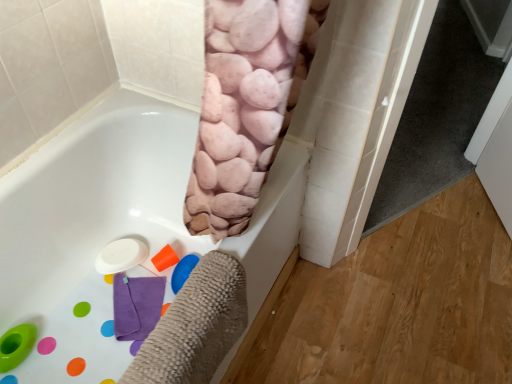
You are a GUI agent. You are given a task and a screenshot of the screen. Output one action in this format:
    pyautogui.click(x=<x>, y=<y>)
    Task: Click on the white matte bathtub at center
    The image size is (512, 384).
    Given the screenshot: What is the action you would take?
    pyautogui.click(x=118, y=226)

Describe the element at coordinates (118, 226) in the screenshot. I see `white matte bathtub at center` at that location.

Where is `white glossy screen door at right`? The height and width of the screenshot is (384, 512). white glossy screen door at right is located at coordinates 436,117.

What do you see at coordinates (436, 117) in the screenshot?
I see `white glossy screen door at right` at bounding box center [436, 117].

Locate an element on the screen. The height and width of the screenshot is (384, 512). white matte bathtub at center is located at coordinates (118, 226).

Is white matte bathtub at center to the right of white glossy screen door at right from the viewer's perspective?

In fact, white matte bathtub at center is to the left of white glossy screen door at right.

In the image, is white matte bathtub at center positioned in front of or behind white glossy screen door at right?

Clearly, white matte bathtub at center is in front of white glossy screen door at right.

Does point (124, 361) lie behind point (466, 164)?

No, (124, 361) is closer to viewer.

From the image's perspective, would you say white matte bathtub at center is shown under white glossy screen door at right?

Indeed, from the image's perspective, white matte bathtub at center is shown beneath white glossy screen door at right.

From a real-world perspective, is white matte bathtub at center under white glossy screen door at right?

Yes, from a real-world perspective, white matte bathtub at center is under white glossy screen door at right.

Which object is thinner, white matte bathtub at center or white glossy screen door at right?

Thinner between the two is white glossy screen door at right.

Considering the sizes of objects white matte bathtub at center and white glossy screen door at right in the image provided, who is taller, white matte bathtub at center or white glossy screen door at right?

Standing taller between the two is white glossy screen door at right.

Considering the relative sizes of white matte bathtub at center and white glossy screen door at right in the image provided, is white matte bathtub at center smaller than white glossy screen door at right?

No, white matte bathtub at center is not smaller than white glossy screen door at right.

Is white matte bathtub at center inside or outside of white glossy screen door at right?

white matte bathtub at center exists outside the volume of white glossy screen door at right.

Is white matte bathtub at center touching white glossy screen door at right?

They are not placed beside each other.

Is white matte bathtub at center oriented towards white glossy screen door at right?

No, white matte bathtub at center is not aimed at white glossy screen door at right.

How much distance is there between white matte bathtub at center and white glossy screen door at right?

white matte bathtub at center is 1.24 meters from white glossy screen door at right.

In order to click on screen door that is above the white matte bathtub at center (from the image's perspective) in this screenshot , I will do `click(436, 117)`.

Considering the positions of objects white glossy screen door at right and white matte bathtub at center in the image provided, who is more to the right, white glossy screen door at right or white matte bathtub at center?

From the viewer's perspective, white glossy screen door at right appears more on the right side.

Does white glossy screen door at right lie behind white matte bathtub at center?

Yes, white glossy screen door at right is behind white matte bathtub at center.

Is point (468, 106) less distant than point (275, 227)?

No, it is not.

From the image's perspective, which one is positioned higher, white glossy screen door at right or white matte bathtub at center?

From the image's view, white glossy screen door at right is above.

Consider the image. From a real-world perspective, is white glossy screen door at right located higher than white matte bathtub at center?

Indeed, from a real-world perspective, white glossy screen door at right stands above white matte bathtub at center.

Does white glossy screen door at right have a lesser width compared to white matte bathtub at center?

Yes, white glossy screen door at right is thinner than white matte bathtub at center.

In the scene shown: Considering the sizes of objects white glossy screen door at right and white matte bathtub at center in the image provided, who is taller, white glossy screen door at right or white matte bathtub at center?

With more height is white glossy screen door at right.

Between white glossy screen door at right and white matte bathtub at center, which one has larger size?

white matte bathtub at center is bigger.

Can white matte bathtub at center be found inside white glossy screen door at right?

Actually, white matte bathtub at center is outside white glossy screen door at right.

Are white glossy screen door at right and white matte bathtub at center making contact?

No, white glossy screen door at right is not with white matte bathtub at center.

Is white glossy screen door at right aimed at white matte bathtub at center?

No, white glossy screen door at right is not turned towards white matte bathtub at center.

How many degrees apart are the facing directions of white glossy screen door at right and white matte bathtub at center?

29.1 degrees separate the facing orientations of white glossy screen door at right and white matte bathtub at center.

I want to click on bathtub below the white glossy screen door at right (from the image's perspective), so click(118, 226).

Find the location of a particular element. The image size is (512, 384). screen door on the right of white matte bathtub at center is located at coordinates (436, 117).

Image resolution: width=512 pixels, height=384 pixels. Identify the location of bathtub below the white glossy screen door at right (from a real-world perspective). (118, 226).